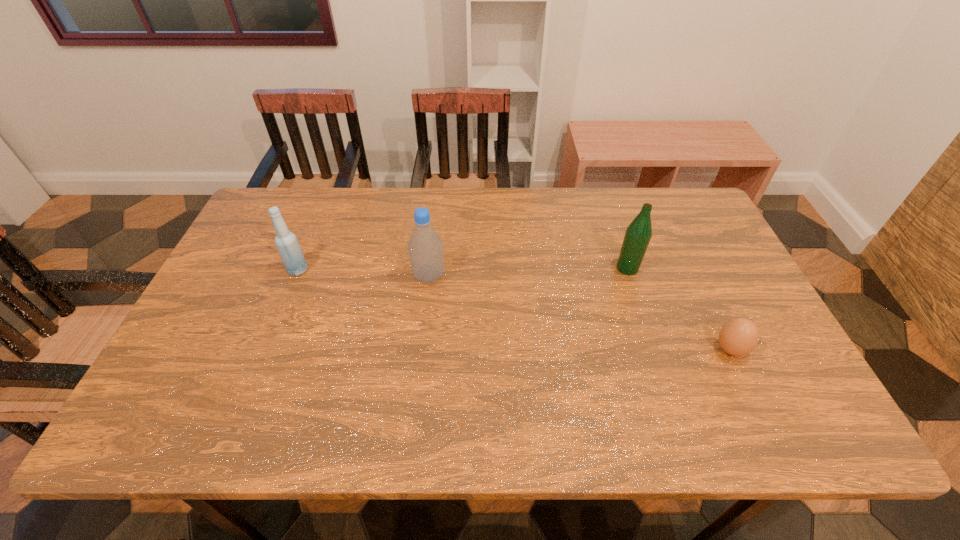
Identify the location of vacant area in the image that satisfies the following two spatial constraints: 1. on the front side of the leftmost bottle; 2. on the left side of the second object from left to right. (296, 276).

You are a GUI agent. You are given a task and a screenshot of the screen. Output one action in this format:
    pyautogui.click(x=<x>, y=<y>)
    Task: Click on the blank area in the image that satisfies the following two spatial constraints: 1. on the front side of the third object from right to left; 2. on the left side of the nearest object
    The height and width of the screenshot is (540, 960).
    Given the screenshot: What is the action you would take?
    pyautogui.click(x=420, y=349)

Where is `vacant space that satisfies the following two spatial constraints: 1. on the front side of the boiled egg; 2. on the left side of the leftmost bottle`? This screenshot has width=960, height=540. vacant space that satisfies the following two spatial constraints: 1. on the front side of the boiled egg; 2. on the left side of the leftmost bottle is located at coordinates (266, 349).

Where is `free space that satisfies the following two spatial constraints: 1. on the front side of the shortest object; 2. on the right side of the second object from left to right`? free space that satisfies the following two spatial constraints: 1. on the front side of the shortest object; 2. on the right side of the second object from left to right is located at coordinates (420, 349).

Find the location of `free space that satisfies the following two spatial constraints: 1. on the front side of the leftmost bottle; 2. on the left side of the second object from left to right`. free space that satisfies the following two spatial constraints: 1. on the front side of the leftmost bottle; 2. on the left side of the second object from left to right is located at coordinates (296, 276).